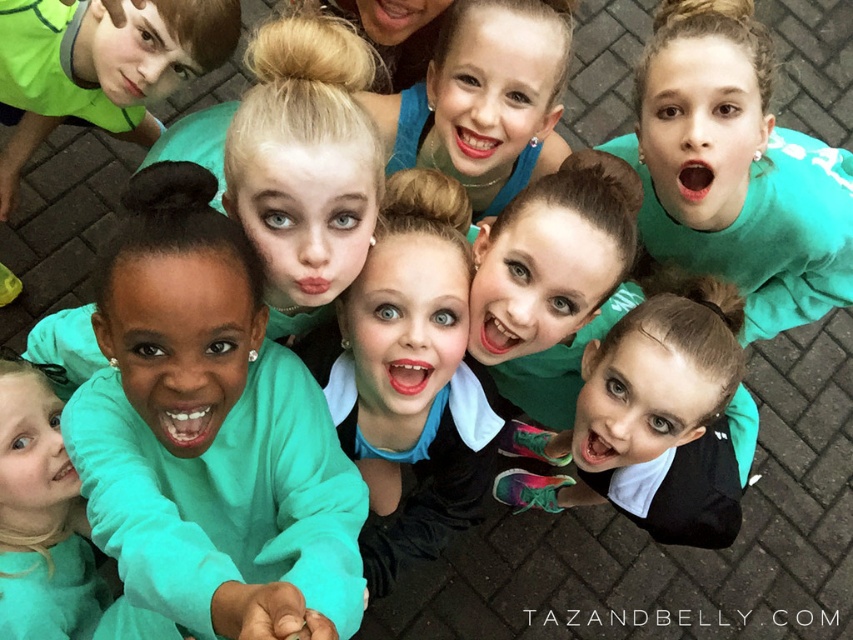
Is teal fleece sweatshirt at center thinner than teal fleece sweatshirt at upper left?

Yes.

Between teal fleece sweatshirt at center and teal fleece sweatshirt at upper left, which one has less height?

With less height is teal fleece sweatshirt at upper left.

Find the location of a particular element. Image resolution: width=853 pixels, height=640 pixels. teal fleece sweatshirt at center is located at coordinates (209, 433).